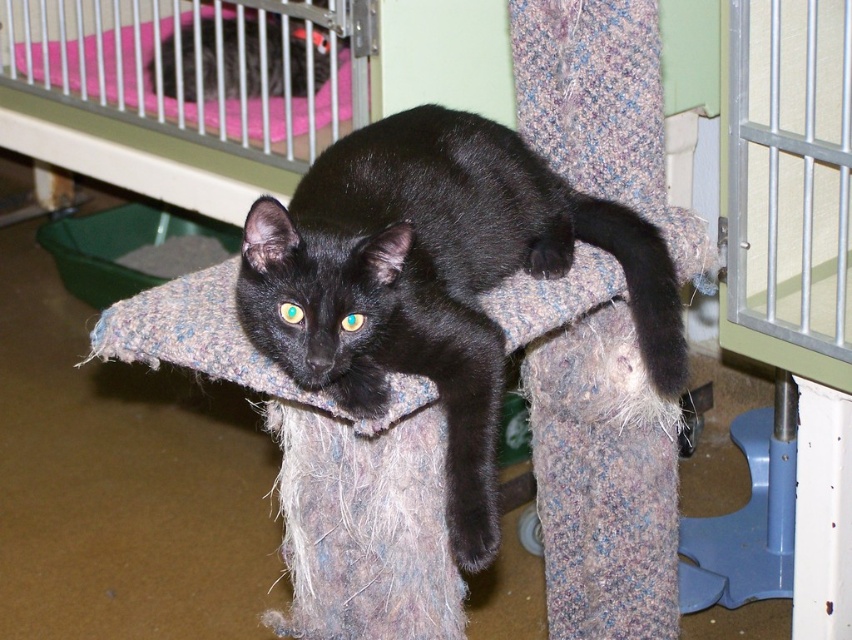
Question: Does black fur cat at center have a smaller size compared to pink fabric infant bed at upper left?

Choices:
 (A) yes
 (B) no

Answer: (A)

Question: Does black fur cat at center appear over black fur cat at upper left?

Choices:
 (A) no
 (B) yes

Answer: (A)

Question: Is black fur cat at center positioned behind black fur cat at upper left?

Choices:
 (A) yes
 (B) no

Answer: (B)

Question: Which is nearer to the black fur cat at center?

Choices:
 (A) pink fabric infant bed at upper left
 (B) black fur cat at upper left

Answer: (A)

Question: Which object appears farthest from the camera in this image?

Choices:
 (A) black fur cat at upper left
 (B) pink fabric infant bed at upper left

Answer: (B)

Question: Which point is closer to the camera?

Choices:
 (A) pink fabric infant bed at upper left
 (B) black fur cat at center
 (C) black fur cat at upper left

Answer: (B)